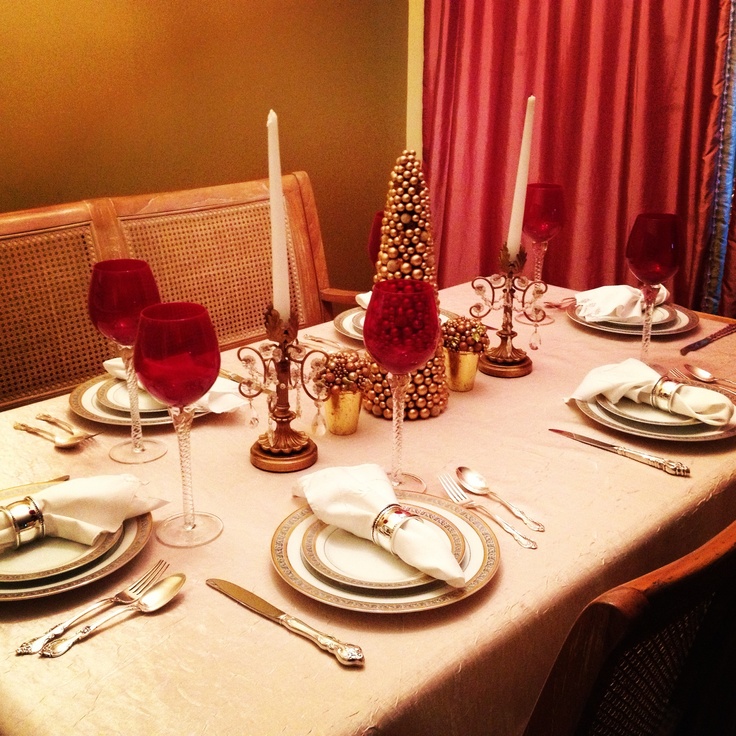
Locate an element on the screen. napkins is located at coordinates (113, 514), (343, 498), (634, 382), (611, 300), (363, 297), (112, 363).